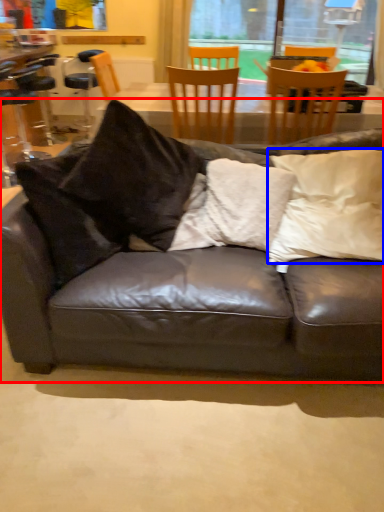
Question: Which of the following is the closest to the observer, studio couch (highlighted by a red box) or pillow (highlighted by a blue box)?

Choices:
 (A) studio couch
 (B) pillow

Answer: (A)